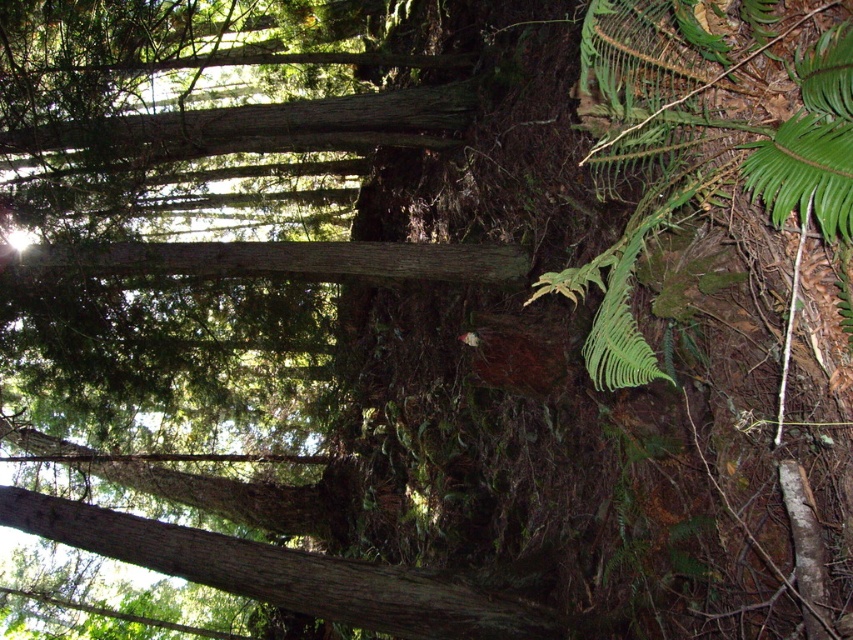
You are a hiker navigating through the dense forest depicted in the scene. You notice two points marked in the image. Based on your position, which point is closer to you? Please choose between the point at coordinates (650,353) and the point at coordinates (132,264).

Point (650,353) is in front of point (132,264), so it is closer to you.

You are an explorer in the forest and need to step over an obstacle. You see the green leafy fern at lower right and the smooth brown log at center. Which one is easier to step over?

The smooth brown log at center is larger than the green leafy fern at lower right, so it is easier to step over the green leafy fern at lower right.

You are a hiker who wants to step onto the smooth brown log at center. From your current position, which direction should you move to reach it first before the green leafy fern at lower right?

You should move to the left to reach the smooth brown log at center first because the green leafy fern at lower right is located to the right of it.